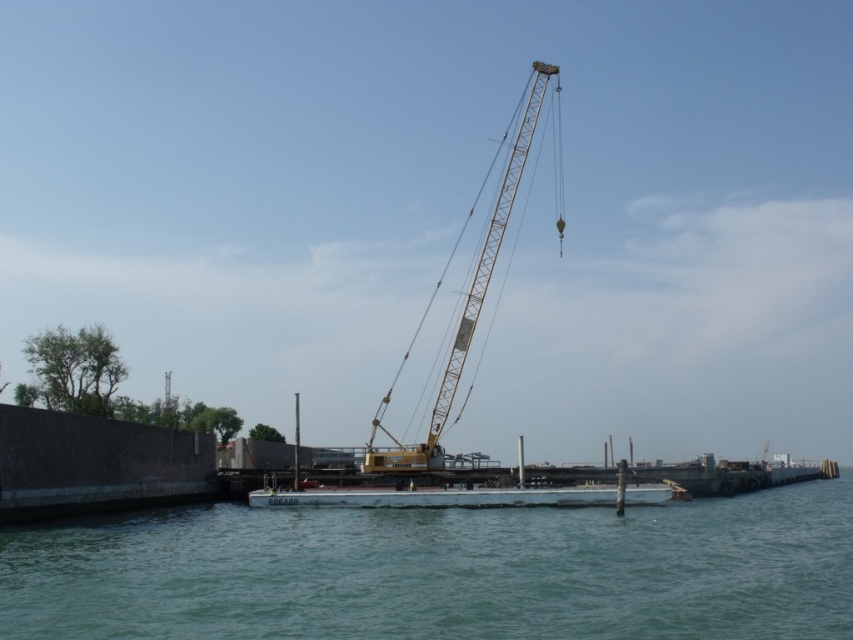
Question: Estimate the real-world distances between objects in this image. Which object is farther from the white matte boat at center?

Choices:
 (A) greenish-blue water at center
 (B) yellow metallic crane at center

Answer: (B)

Question: Can you confirm if greenish-blue water at center is smaller than yellow metallic crane at center?

Choices:
 (A) no
 (B) yes

Answer: (B)

Question: Is greenish-blue water at center bigger than white matte boat at center?

Choices:
 (A) yes
 (B) no

Answer: (A)

Question: Which of the following is the closest to the observer?

Choices:
 (A) (848, 605)
 (B) (534, 506)
 (C) (456, 380)

Answer: (A)

Question: Which object appears closest to the camera in this image?

Choices:
 (A) white matte boat at center
 (B) yellow metallic crane at center
 (C) greenish-blue water at center

Answer: (C)

Question: Can you confirm if greenish-blue water at center is positioned to the right of white matte boat at center?

Choices:
 (A) no
 (B) yes

Answer: (A)